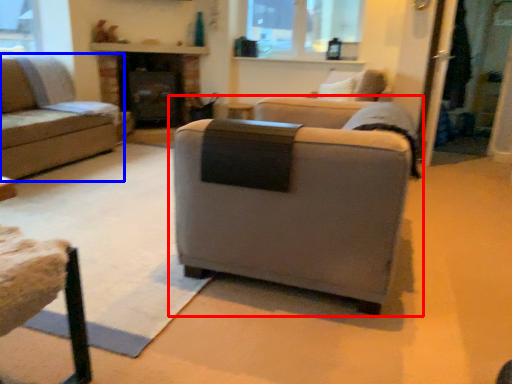
Question: Which object is closer to the camera taking this photo, studio couch (highlighted by a red box) or studio couch (highlighted by a blue box)?

Choices:
 (A) studio couch
 (B) studio couch

Answer: (A)